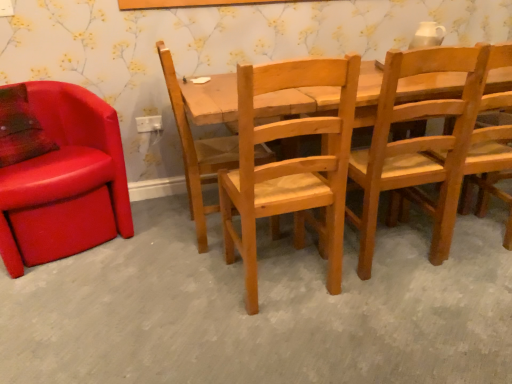
This screenshot has height=384, width=512. I want to click on vacant space situated on the left part of natural wood chair at center, the 2th chair viewed from the left, so click(151, 237).